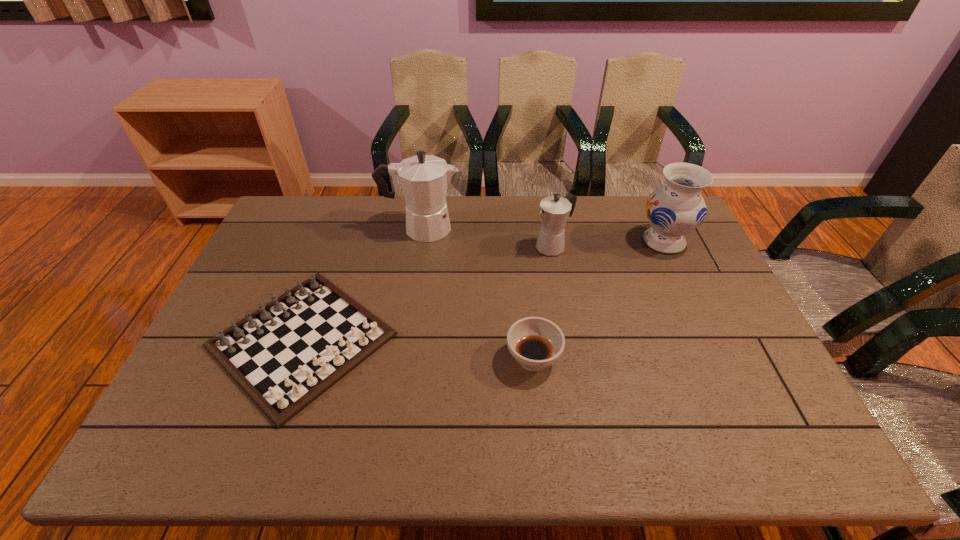
This screenshot has height=540, width=960. What are the coordinates of `free point between the rightmost object and the shortest object` in the screenshot? It's located at (483, 291).

Locate an element on the screen. free point between the right coffeepot and the shortest object is located at coordinates (427, 293).

Choose which object is the third nearest neighbor to the vase. Please provide its 2D coordinates. Your answer should be formatted as a tuple, i.e. [(x, y)], where the tuple contains the x and y coordinates of a point satisfying the conditions above.

[(424, 179)]

The height and width of the screenshot is (540, 960). I want to click on object that stands as the fourth closest to the left coffeepot, so click(x=677, y=208).

At what (x,y) coordinates should I click in order to perform the action: click on vacant space that satisfies the following two spatial constraints: 1. on the back side of the vase; 2. at the spout of the taller coffeepot. Please return your answer as a coordinate pair (x, y). Looking at the image, I should click on (658, 228).

The image size is (960, 540). I want to click on free space in the image that satisfies the following two spatial constraints: 1. on the back side of the vase; 2. at the spout of the left coffeepot, so click(658, 228).

Where is `free location that satisfies the following two spatial constraints: 1. on the back side of the vase; 2. on the right side of the shortest object`? This screenshot has height=540, width=960. free location that satisfies the following two spatial constraints: 1. on the back side of the vase; 2. on the right side of the shortest object is located at coordinates (338, 241).

Find the location of a particular element. The height and width of the screenshot is (540, 960). blank area in the image that satisfies the following two spatial constraints: 1. at the spout of the taller coffeepot; 2. on the front side of the chessboard is located at coordinates (403, 340).

Identify the location of free spot that satisfies the following two spatial constraints: 1. on the back side of the shorter coffeepot; 2. on the right side of the vase. (552, 241).